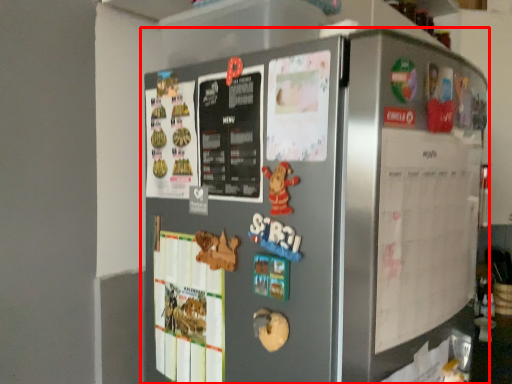
Question: From the image, what is the correct spatial relationship of refrigerator (annotated by the red box) in relation to menu?

Choices:
 (A) left
 (B) right

Answer: (A)